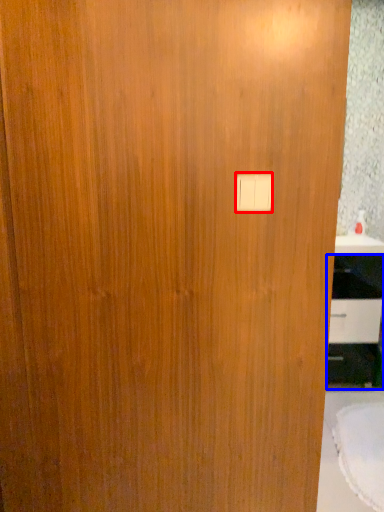
Question: Which point is closer to the camera, light switch (highlighted by a red box) or cabinetry (highlighted by a blue box)?

Choices:
 (A) light switch
 (B) cabinetry

Answer: (A)